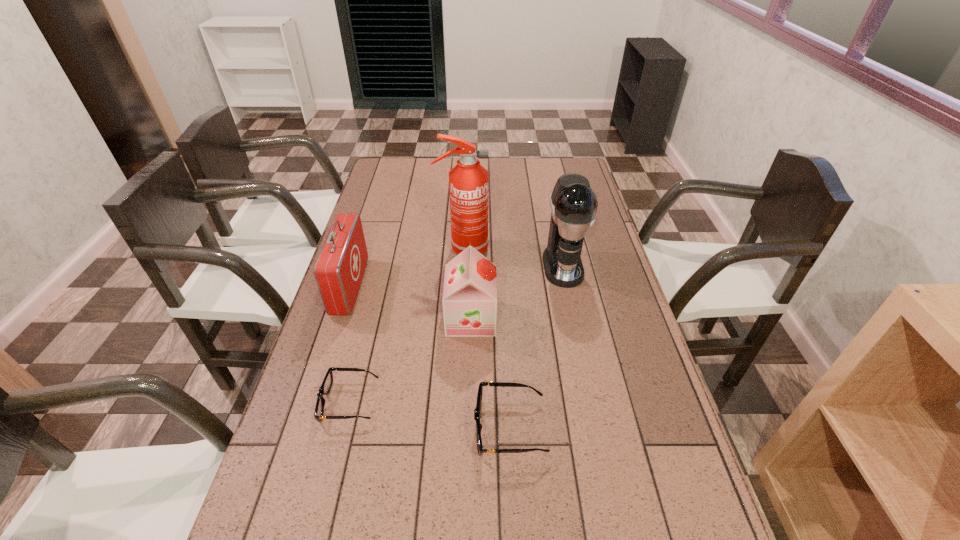
Find the location of a particular element. The width and height of the screenshot is (960, 540). free location located on the front-facing side of the second shortest object is located at coordinates click(334, 428).

This screenshot has width=960, height=540. What are the coordinates of `vacant space located on the front-facing side of the second shortest object` in the screenshot? It's located at (448, 428).

Find the location of `vacant space located 0.280m on the front-facing side of the second shortest object`. vacant space located 0.280m on the front-facing side of the second shortest object is located at coordinates (355, 428).

The image size is (960, 540). I want to click on blank space located with the cap open on the soya milk, so 516,318.

I want to click on free space located place cup under the spout of the second tallest object, so click(584, 366).

You are a GUI agent. You are given a task and a screenshot of the screen. Output one action in this format:
    pyautogui.click(x=<x>, y=<y>)
    Task: Click on the free spot located 0.120m on the side of the first-aid kit with the first aid cross symbol
    Image resolution: width=960 pixels, height=540 pixels.
    Given the screenshot: What is the action you would take?
    pyautogui.click(x=399, y=287)

Identify the location of free space located at the nozzle of the fire extinguisher. 503,249.

At what (x,y) coordinates should I click in order to perform the action: click on sunglasses present at the left edge. Please return your answer as a coordinate pair (x, y). The width and height of the screenshot is (960, 540). Looking at the image, I should click on (325, 388).

You are a GUI agent. You are given a task and a screenshot of the screen. Output one action in this format:
    pyautogui.click(x=<x>, y=<y>)
    Task: Click on the first-aid kit located in the left edge section of the desktop
    
    Given the screenshot: What is the action you would take?
    pyautogui.click(x=339, y=269)

Find the location of `object at the right edge`. object at the right edge is located at coordinates (x=573, y=203).